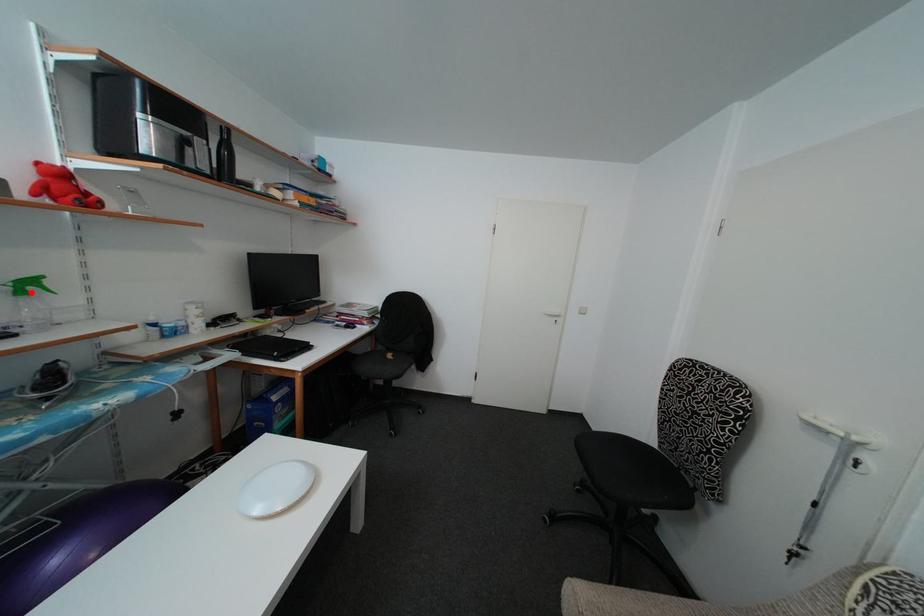
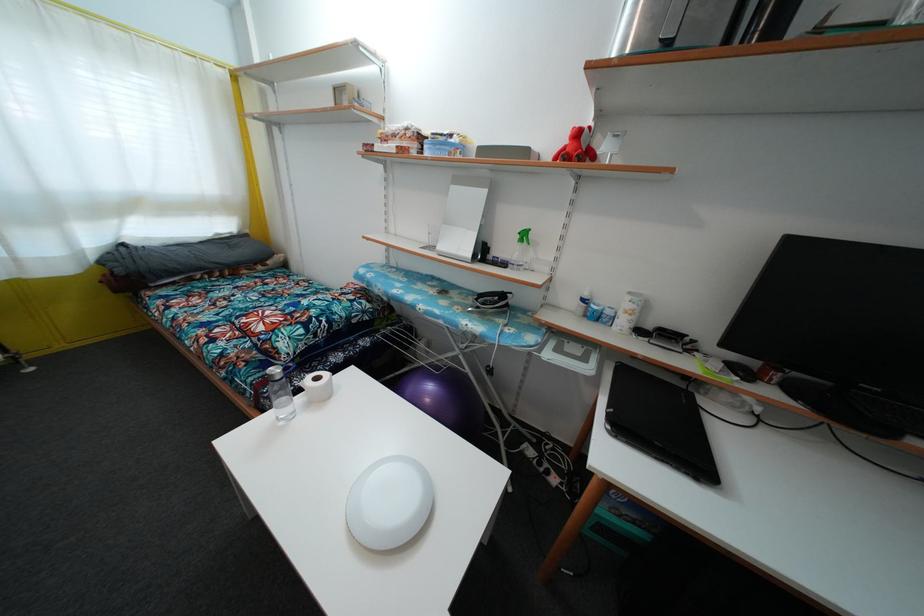
In the second image, find the point that corresponds to the highlighted location in the first image.

(528, 241)